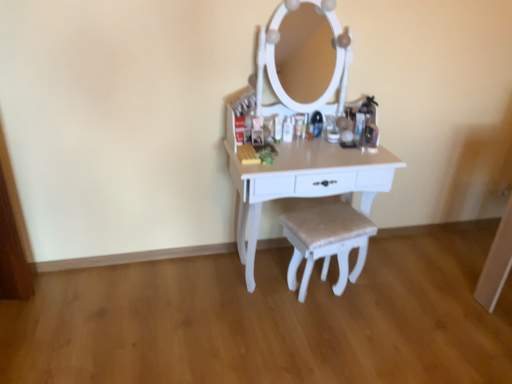
Locate an element on the screen. This screenshot has height=384, width=512. free region on the left part of beige fabric stool at center is located at coordinates (262, 298).